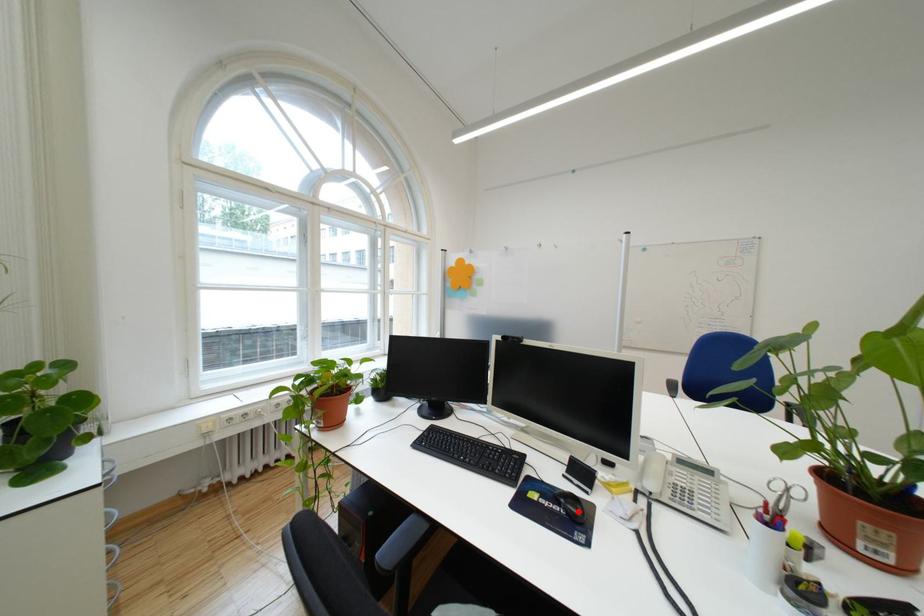
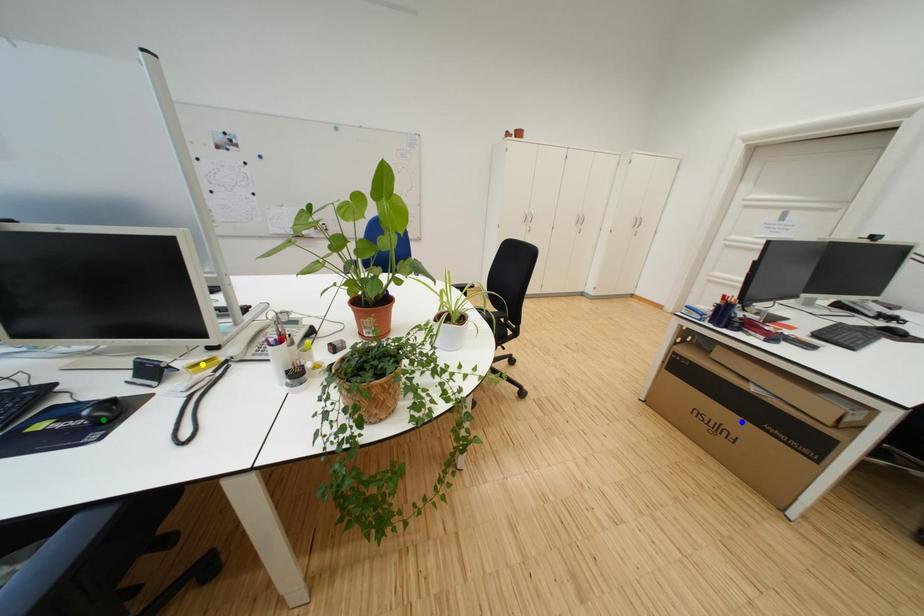
Question: I am providing you with two images of the same scene from different viewpoints. A red point is marked on the first image. You are given multiple points on the second image. Which spot in image 2 lines up with the point in image 1?

Choices:
 (A) green point
 (B) blue point
 (C) yellow point

Answer: (A)